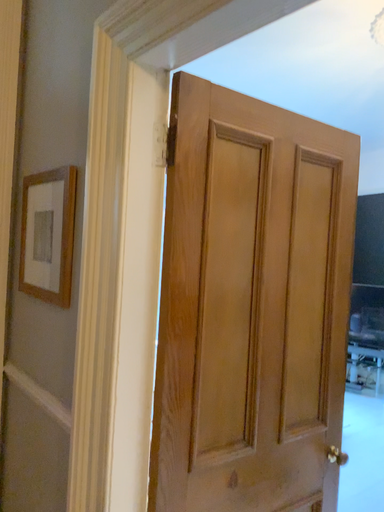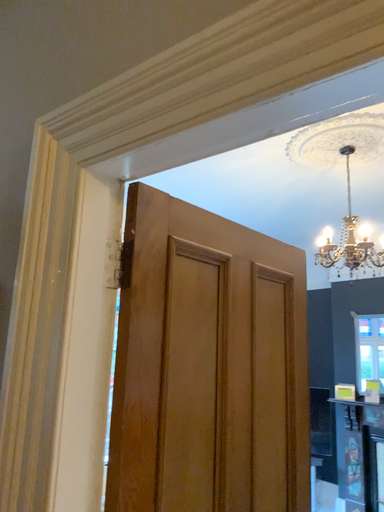
Question: Which way did the camera rotate in the video?

Choices:
 (A) rotated left
 (B) rotated right

Answer: (B)